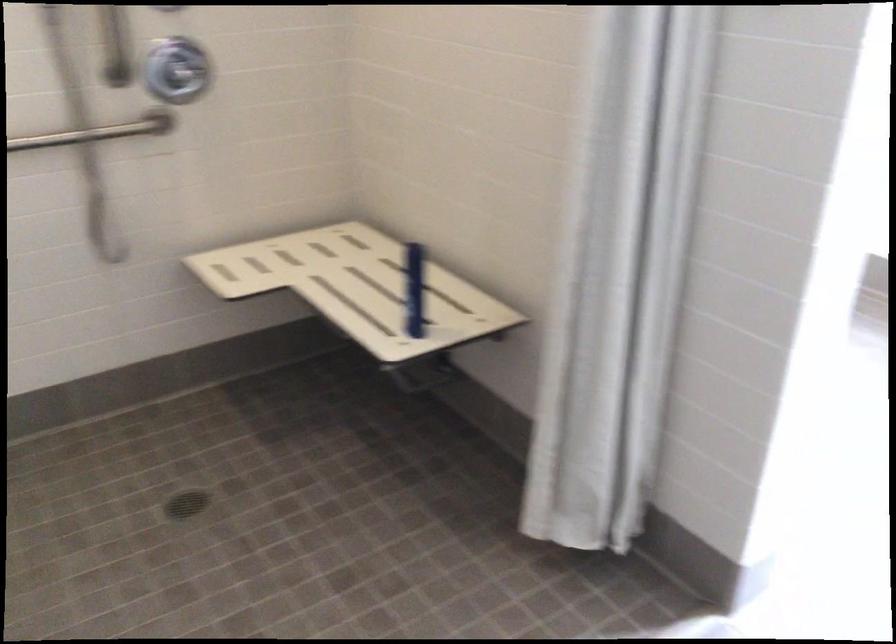
Where would you sit the chair sitting surface? Please return your answer as a coordinate pair (x, y).

(357, 287)